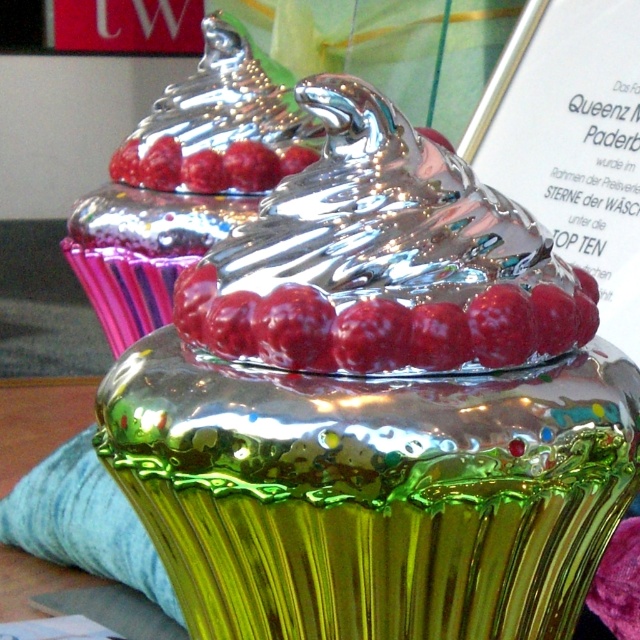
Does shiny metallic muffin at center have a greater height compared to shiny metallic raspberry at center?

Yes.

Does point (131, 237) come in front of point (371, 353)?

No, (131, 237) is behind (371, 353).

Locate an element on the screen. The width and height of the screenshot is (640, 640). shiny metallic muffin at center is located at coordinates (186, 180).